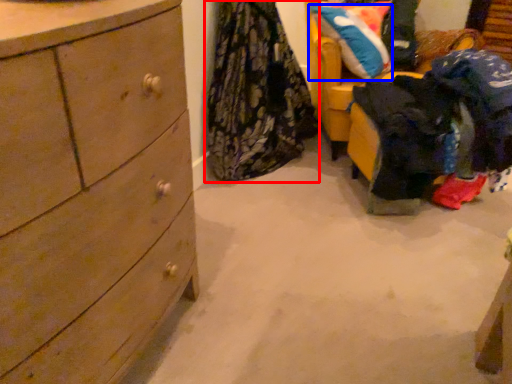
Question: Which object appears closest to the camera in this image, clothing (highlighted by a red box) or pillow (highlighted by a blue box)?

Choices:
 (A) clothing
 (B) pillow

Answer: (A)